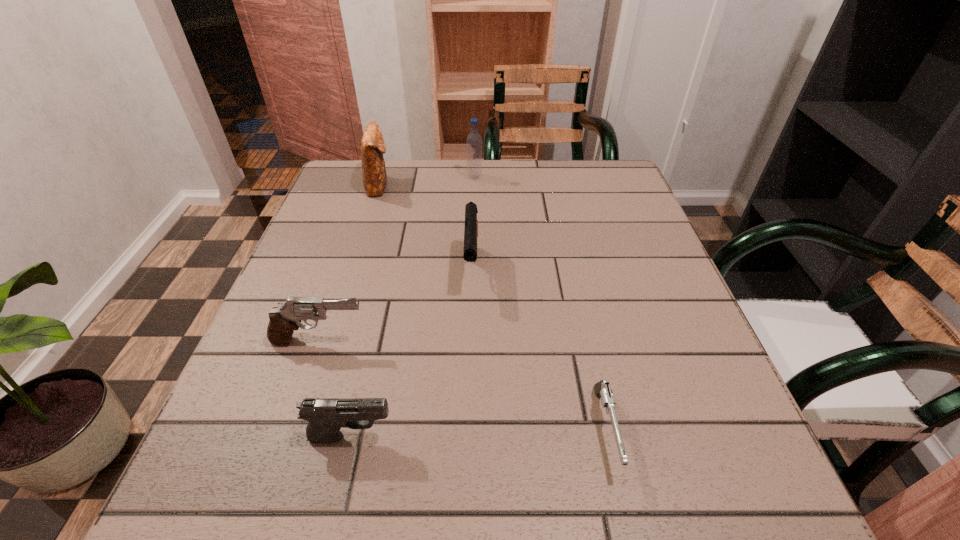
Image resolution: width=960 pixels, height=540 pixels. I want to click on vacant space located at the barrel of the third farthest object, so click(468, 438).

Find the location of a particular element. This screenshot has width=960, height=540. vacant space located 0.250m at the barrel of the third nearest pistol is located at coordinates (506, 341).

Image resolution: width=960 pixels, height=540 pixels. Identify the location of vacant space located at the barrel of the fifth tallest object. point(488,436).

Locate an element on the screen. This screenshot has width=960, height=540. blank area located 0.050m on the front-facing side of the rightmost pistol is located at coordinates (626, 521).

Locate an element on the screen. The image size is (960, 540). water bottle at the far edge is located at coordinates (474, 140).

You are a GUI agent. You are given a task and a screenshot of the screen. Output one action in this format:
    pyautogui.click(x=<x>, y=<y>)
    Task: Click on the clutch bag that is at the far edge
    Image resolution: width=960 pixels, height=540 pixels.
    Given the screenshot: What is the action you would take?
    pyautogui.click(x=373, y=147)

The image size is (960, 540). What are the coordinates of `object that is at the near edge` in the screenshot? It's located at (602, 389).

Locate an element on the screen. clutch bag situated at the left edge is located at coordinates (373, 147).

You are a GUI agent. You are given a task and a screenshot of the screen. Output one action in this format:
    pyautogui.click(x=<x>, y=<y>)
    Task: Click on the object at the far left corner
    This screenshot has height=540, width=960.
    Given the screenshot: What is the action you would take?
    pyautogui.click(x=373, y=147)

Where is `vacant region at the far edge of the desktop`? vacant region at the far edge of the desktop is located at coordinates (490, 169).